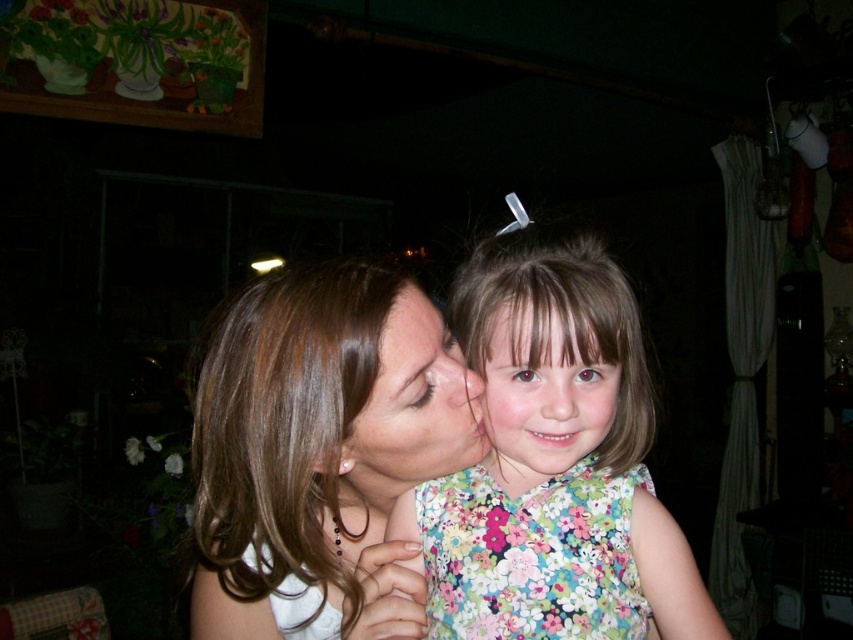
Question: Which object is the farthest from the floral fabric face at center?

Choices:
 (A) smooth skin forehead at center
 (B) smooth brown hair at center
 (C) floral fabric dress at center
 (D) smooth skin face at center

Answer: (B)

Question: In this image, where is smooth skin face at center located relative to smooth skin forehead at center?

Choices:
 (A) below
 (B) above

Answer: (A)

Question: Which object is the closest to the floral fabric dress at center?

Choices:
 (A) floral fabric face at center
 (B) smooth brown hair at center

Answer: (A)

Question: Is smooth brown hair at center positioned before smooth skin face at center?

Choices:
 (A) no
 (B) yes

Answer: (B)

Question: Among these points, which one is farthest from the camera?

Choices:
 (A) (323, 493)
 (B) (554, 548)
 (C) (511, 301)
 (D) (413, 333)

Answer: (A)

Question: Is smooth brown hair at center smaller than floral fabric face at center?

Choices:
 (A) no
 (B) yes

Answer: (A)